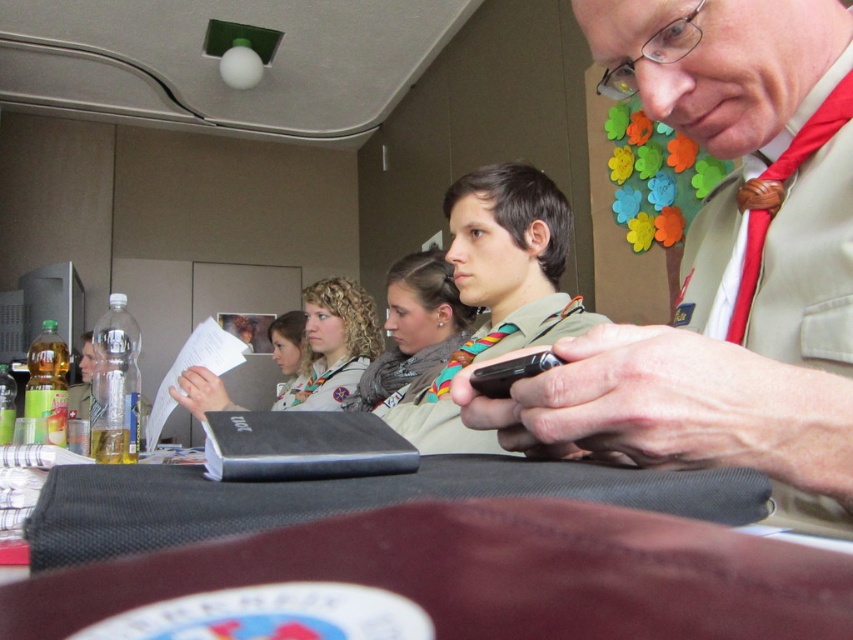
Question: In this image, where is black fabric table at lower center located relative to white fabric scarf at center?

Choices:
 (A) above
 (B) below

Answer: (A)

Question: Which is nearer to the black fabric table at lower center?

Choices:
 (A) scout uniform at center
 (B) matte khaki shirt at center
 (C) black plastic phone at center

Answer: (C)

Question: Which of the following is the closest to the observer?

Choices:
 (A) (409, 392)
 (B) (676, 129)
 (C) (279, 404)

Answer: (B)

Question: Is black fabric table at lower center bigger than curly blonde hair at center?

Choices:
 (A) yes
 (B) no

Answer: (B)

Question: Which point is farther to the camera?

Choices:
 (A) (338, 404)
 (B) (787, 497)
 (C) (292, 384)
 (D) (531, 200)

Answer: (C)

Question: Does khaki uniform at upper right have a greater width compared to curly blonde hair at center?

Choices:
 (A) no
 (B) yes

Answer: (B)